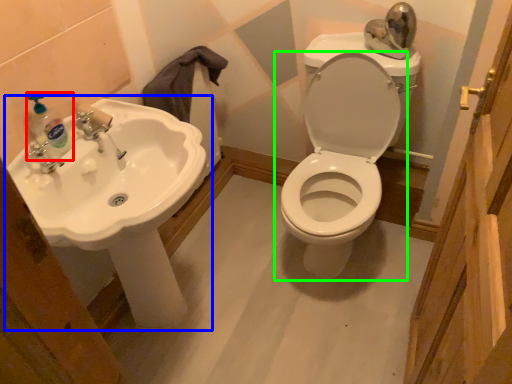
Question: Which is nearer to the soap dispenser (highlighted by a red box)? sink (highlighted by a blue box) or toilet (highlighted by a green box).

Choices:
 (A) sink
 (B) toilet

Answer: (A)